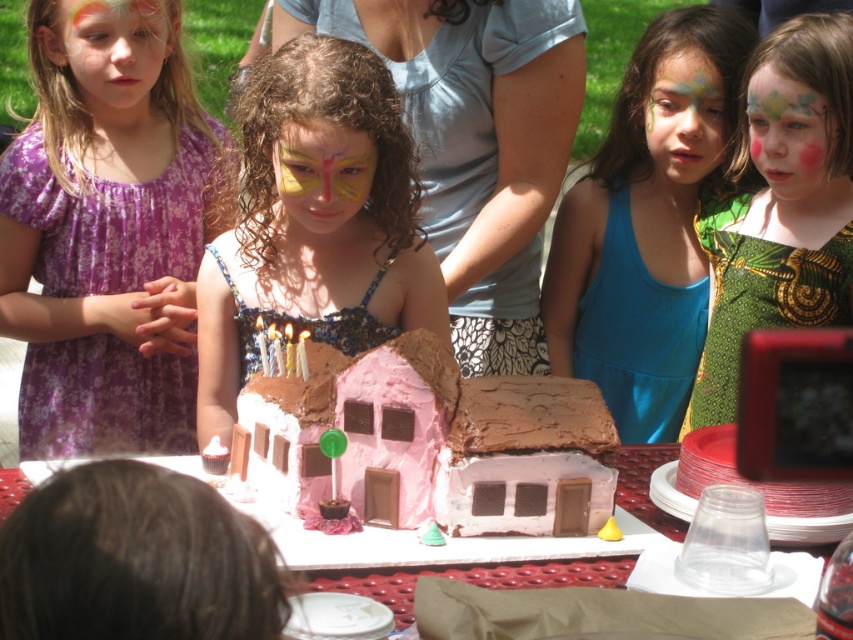
Question: Is the position of smooth white table at center less distant than that of matte green face paint at center?

Choices:
 (A) yes
 (B) no

Answer: (A)

Question: Does green textured dress at center appear under pastel rainbow face paint at upper left?

Choices:
 (A) yes
 (B) no

Answer: (A)

Question: Is matte purple dress at left bigger than blue fabric dress at center?

Choices:
 (A) no
 (B) yes

Answer: (A)

Question: Which point appears closest to the camera in this image?

Choices:
 (A) (91, 36)
 (B) (366, 241)
 (C) (560, 276)

Answer: (B)

Question: Which object is closer to the camera taking this photo?

Choices:
 (A) matte pink cake at center
 (B) pastel rainbow face paint at upper left

Answer: (A)

Question: Among these objects, which one is farthest from the camera?

Choices:
 (A) pink chocolate house at center
 (B) matte pink cake at center
 (C) pastel rainbow face paint at upper left

Answer: (C)